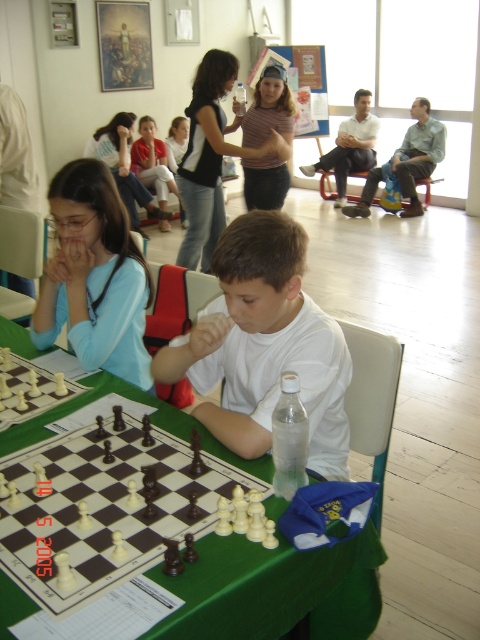
You are standing in the community center and see two points marked on the floor. The first point is at coordinates point [264,173] and the second is at point [118,168]. Which point is closer to you?

Point [264,173] is closer to the viewer than point [118,168].

What is the color of the shirt worn by the child sitting at the position marked by the point (95, 276)?

The point (95, 276) corresponds to the matte blue shirt at left, so the color of the shirt is blue.

You are a photographer trying to capture a closeup of both the matte white shirt at center and the light blue fabric shirt at upper left in the scene. Given their sizes, which shirt would require you to move closer to get a clear shot?

The matte white shirt at center has a lesser width compared to the light blue fabric shirt at upper left, so you would need to move closer to the matte white shirt at center to capture it clearly in the closeup.